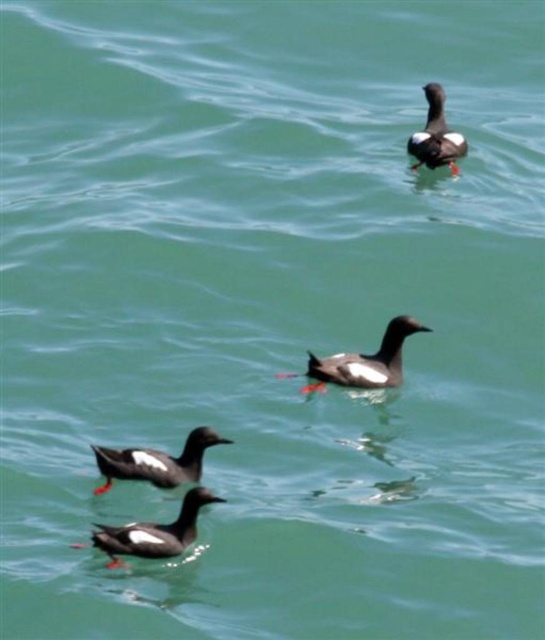
You are a photographer trying to capture a clear shot of the matte black duck at lower left and the dark brown feathers at upper right. Which bird is positioned closer to your camera lens?

The matte black duck at lower left is closer to the viewer than the dark brown feathers at upper right, so the matte black duck at lower left will appear larger in your photo.

You are a wildlife photographer observing the scene. You notice the dark brown feathers at center and the matte black duck at lower left. Which object is positioned higher in the image?

The dark brown feathers at center is positioned higher than the matte black duck at lower left.